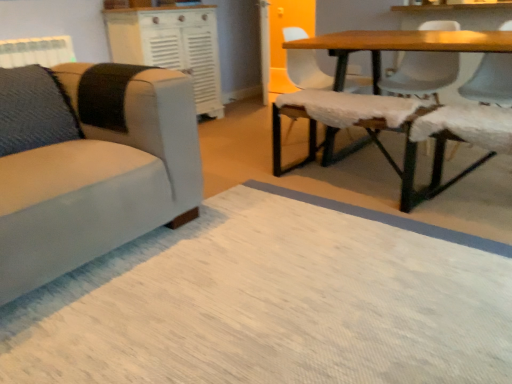
Question: In terms of width, does white textured cabinet at upper center look wider or thinner when compared to fuzzy fabric swivel chair at center?

Choices:
 (A) wide
 (B) thin

Answer: (B)

Question: Is white textured cabinet at upper center in front of or behind fuzzy fabric swivel chair at center in the image?

Choices:
 (A) front
 (B) behind

Answer: (B)

Question: Which is farther from the white textured bench at right, which is the 3th chair in right-to-left order?

Choices:
 (A) fuzzy fabric swivel chair at center
 (B) fur-covered bench at lower right
 (C) suede beige chair at left, marked as the first chair in a left-to-right arrangement
 (D) white fabric chair at upper right, which appears as the 2th chair when viewed from the left
 (E) white textured cabinet at upper center

Answer: (E)

Question: Which object is the farthest from the white textured cabinet at upper center?

Choices:
 (A) suede beige chair at left, marked as the first chair in a left-to-right arrangement
 (B) white textured bench at right, placed as the 3th chair when sorted from left to right
 (C) smooth white chair at upper right, which is the 1th chair in right-to-left order
 (D) wooden bench at right
 (E) white textured radiator at upper left

Answer: (B)